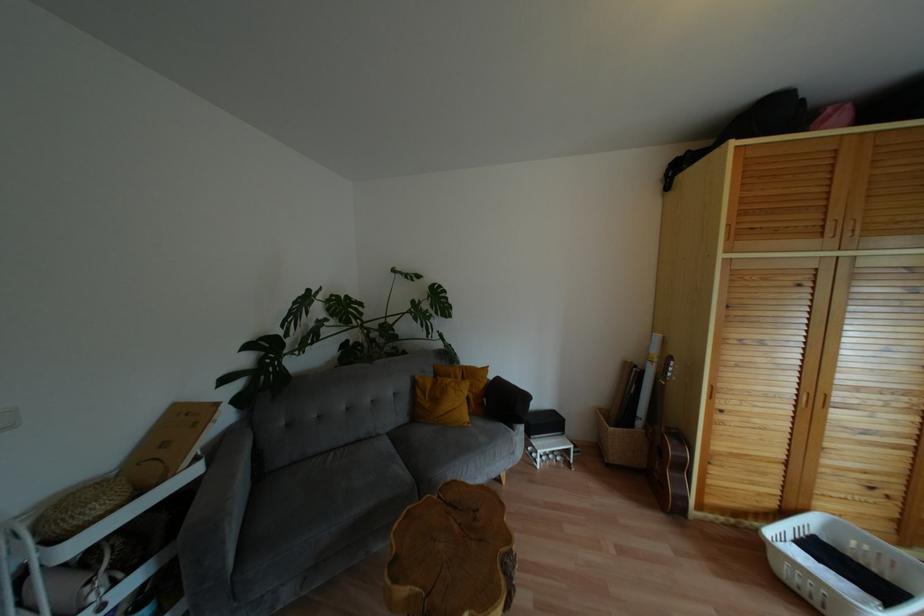
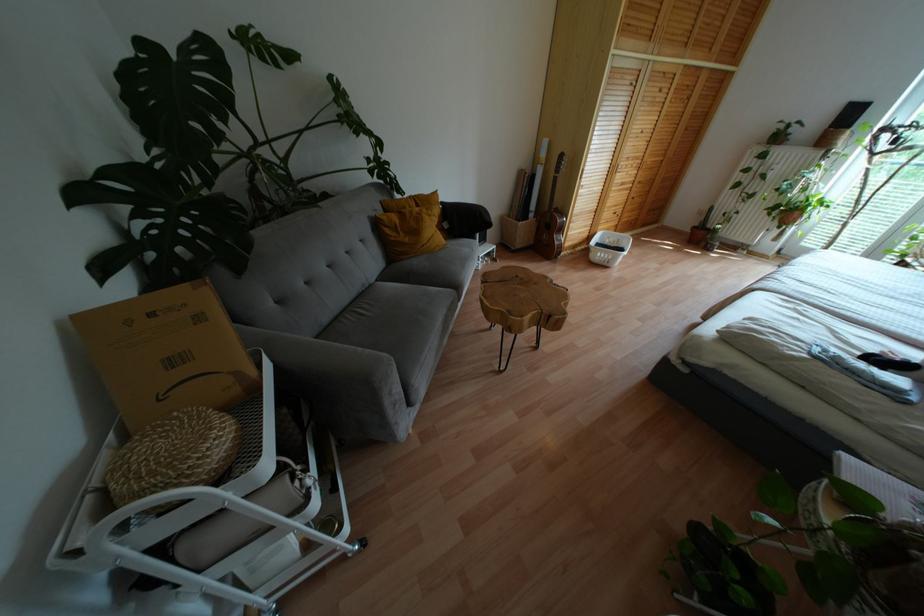
The point at (x=378, y=435) is marked in the first image. Where is the corresponding point in the second image?

(370, 284)